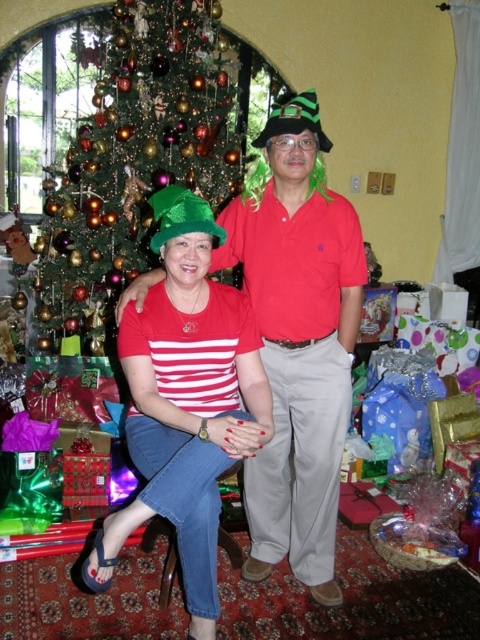
Question: Which of the following is the farthest from the observer?

Choices:
 (A) matte green hat at center
 (B) green felt hat at center

Answer: (B)

Question: Can you confirm if green felt hat at center is wider than green felt hat at upper center?

Choices:
 (A) yes
 (B) no

Answer: (B)

Question: Which object is closer to the camera taking this photo?

Choices:
 (A) shiny green christmas tree at left
 (B) green felt hat at center
 (C) matte green hat at center

Answer: (C)

Question: Does shiny green christmas tree at left appear on the right side of green felt hat at center?

Choices:
 (A) yes
 (B) no

Answer: (B)

Question: Where is shiny green christmas tree at left located in relation to green felt hat at center in the image?

Choices:
 (A) above
 (B) below

Answer: (A)

Question: Which point is closer to the camera?

Choices:
 (A) (101, 570)
 (B) (171, 92)
 (C) (264, 145)
 (D) (286, 488)

Answer: (A)